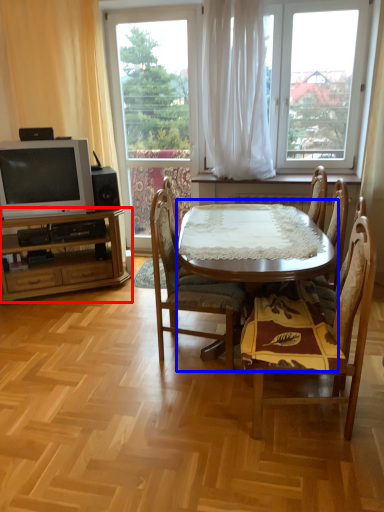
Question: Which of the following is the farthest to the observer, cabinetry (highlighted by a red box) or round table (highlighted by a blue box)?

Choices:
 (A) cabinetry
 (B) round table

Answer: (A)